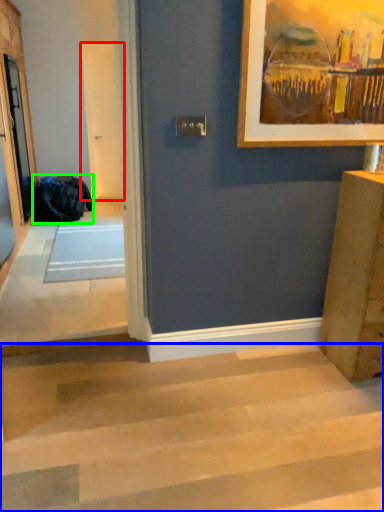
Question: Which is farther away from screen door (highlighted by a red box)? stairwell (highlighted by a blue box) or laundry (highlighted by a green box)?

Choices:
 (A) stairwell
 (B) laundry

Answer: (A)